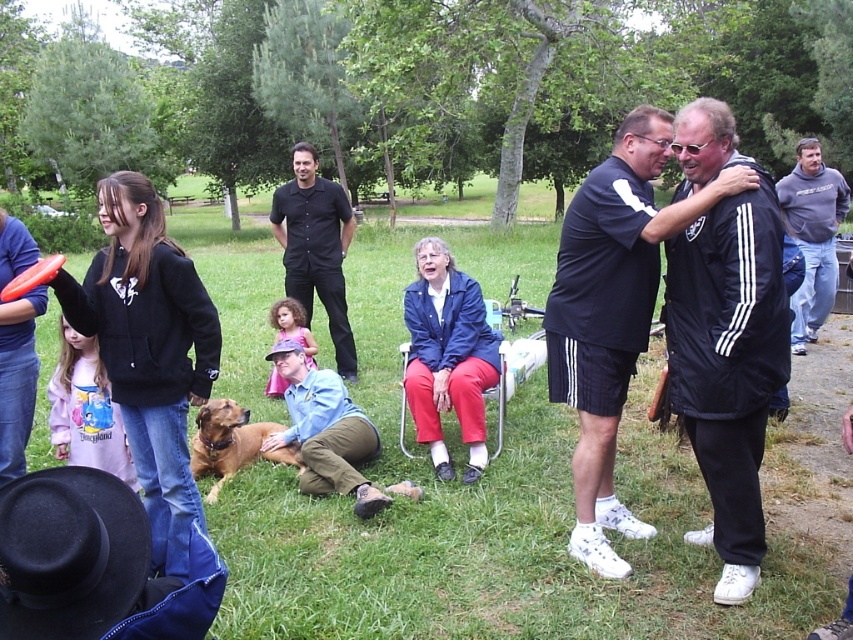
Question: Among these objects, which one is nearest to the camera?

Choices:
 (A) black adidas tracksuit at center
 (B) green grass at center
 (C) blue fabric jacket at center
 (D) brown furry dog at lower left

Answer: (A)

Question: Which point is farther to the camera?

Choices:
 (A) (728, 580)
 (B) (316, 259)

Answer: (B)

Question: Is black adidas tracksuit at center below gray fleece hoodie at upper right?

Choices:
 (A) no
 (B) yes

Answer: (B)

Question: Is matte black hoodie at left to the right of orange matte frisbee at left from the viewer's perspective?

Choices:
 (A) no
 (B) yes

Answer: (B)

Question: Which point is closer to the camera?

Choices:
 (A) green grass at center
 (B) blue fabric jacket at center
 (C) matte black hoodie at left
 (D) brown furry dog at lower left

Answer: (C)

Question: In this image, where is black adidas tracksuit at center located relative to orange matte frisbee at left?

Choices:
 (A) right
 (B) left

Answer: (A)